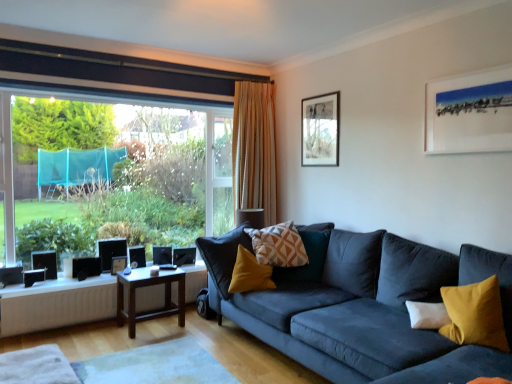
Question: Is white matte radiator at lower left closer to camera compared to brown wooden table at center, the 2th table when ordered from top to bottom?

Choices:
 (A) no
 (B) yes

Answer: (B)

Question: Does white matte radiator at lower left appear on the left side of brown wooden table at center, the 2th table when ordered from top to bottom?

Choices:
 (A) yes
 (B) no

Answer: (A)

Question: Does white matte radiator at lower left have a smaller size compared to brown wooden table at center, the 2th table when ordered from top to bottom?

Choices:
 (A) no
 (B) yes

Answer: (B)

Question: From the image's perspective, would you say white matte radiator at lower left is shown under brown wooden table at center, the first table when ordered from bottom to top?

Choices:
 (A) yes
 (B) no

Answer: (A)

Question: Is white matte radiator at lower left bigger than brown wooden table at center, the 2th table when ordered from top to bottom?

Choices:
 (A) yes
 (B) no

Answer: (B)

Question: Relative to transparent glass window at left, is white matte radiator at lower left in front or behind?

Choices:
 (A) behind
 (B) front

Answer: (A)

Question: In terms of width, does white matte radiator at lower left look wider or thinner when compared to transparent glass window at left?

Choices:
 (A) thin
 (B) wide

Answer: (A)

Question: From the image's perspective, is white matte radiator at lower left located above or below transparent glass window at left?

Choices:
 (A) above
 (B) below

Answer: (B)

Question: Is point (59, 304) positioned closer to the camera than point (145, 203)?

Choices:
 (A) closer
 (B) farther

Answer: (A)

Question: From the image's perspective, is geometric-patterned fabric pillow at center, the 2th pillow when ordered from right to left, positioned above or below black matte speaker at lower left, positioned as the second speaker in right-to-left order?

Choices:
 (A) above
 (B) below

Answer: (A)

Question: Is geometric-patterned fabric pillow at center, marked as the 2th pillow in a front-to-back arrangement, wider or thinner than black matte speaker at lower left, the 2th speaker positioned from the front?

Choices:
 (A) thin
 (B) wide

Answer: (B)

Question: Is point (292, 228) closer or farther from the camera than point (77, 263)?

Choices:
 (A) closer
 (B) farther

Answer: (A)

Question: Is geometric-patterned fabric pillow at center, the 1th pillow viewed from the back, inside or outside of black matte speaker at lower left, the 2th speaker positioned from the front?

Choices:
 (A) inside
 (B) outside

Answer: (B)

Question: Is brown wooden table at center, the first table when ordered from bottom to top, inside the boundaries of wooden table at lower center, which appears as the second table when ordered from the bottom, or outside?

Choices:
 (A) outside
 (B) inside

Answer: (A)

Question: From the image's perspective, is brown wooden table at center, the 2th table when ordered from top to bottom, positioned above or below wooden table at lower center, which appears as the second table when ordered from the bottom?

Choices:
 (A) above
 (B) below

Answer: (B)